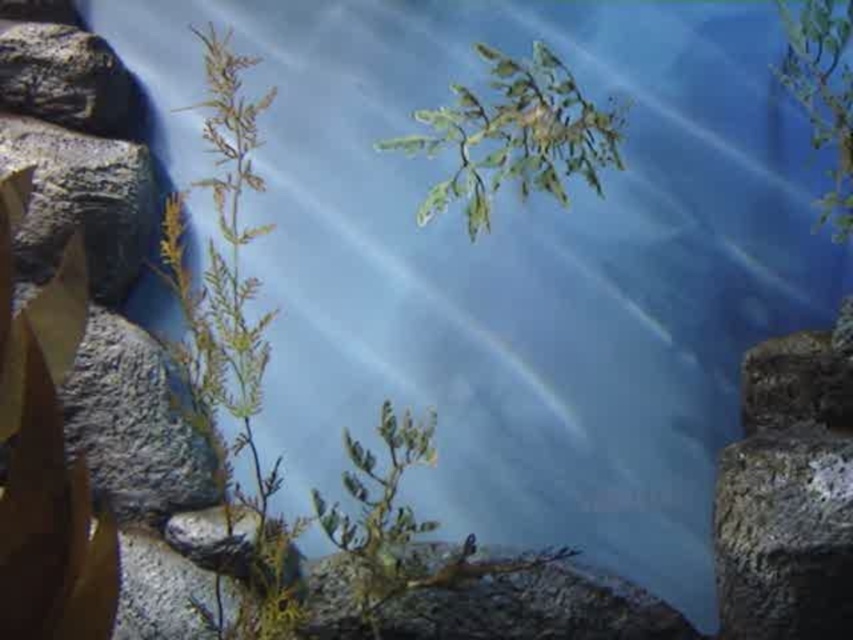
You are a hiker trying to determine if you can safely step over the rough gray rock at left without touching the green leafy plant at upper center. Based on their heights, can you do this?

The green leafy plant at upper center is taller than the rough gray rock at left. Since the plant is taller, you would need to step over both the rock and the plant, making it difficult to avoid touching the plant while stepping over the rock.

You are a botanist studying the plants in this rocky terrain. You notice two plants, the green leafy plant at left and the green leafy plant at upper center. Which of these two plants is taller?

The green leafy plant at left is taller than the green leafy plant at upper center.